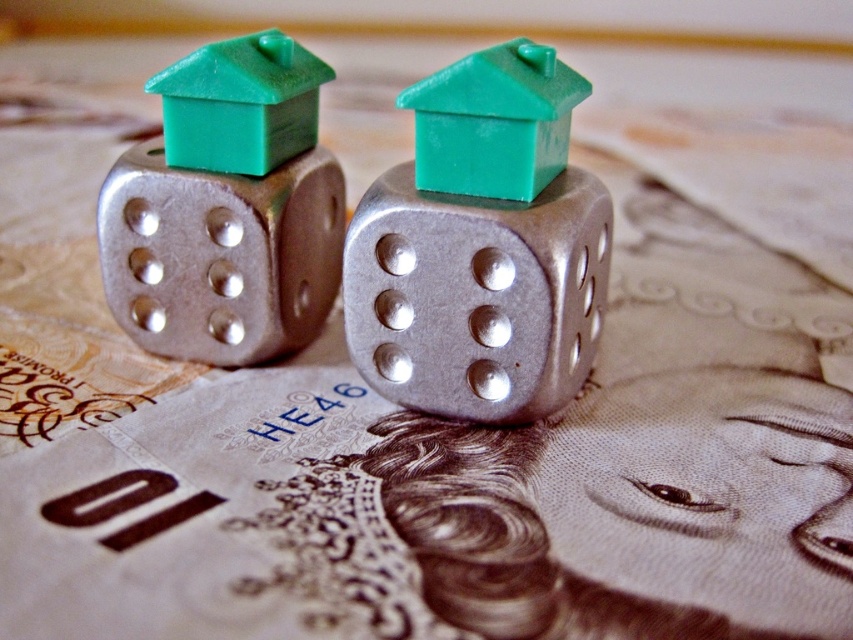
You are examining a banknote with two metallic dice on it. The coordinates point to an object on the banknote. Which object is located at point (219, 256)?

The point (219, 256) corresponds to the metallic silver dice at left.

You are standing in front of a banknote with two metallic dice on it. The dice have green houses on top. Where is the point located at coordinates point (476, 296)?

The point at coordinates point (476, 296) indicates the location of the brushed metal dice at center.

You are a currency inspector examining a counterfeit banknote. You notice two objects on top of the banknote in the image. Which object is larger in size between the brushed metal dice at center and the green matte house at upper center?

The brushed metal dice at center is bigger than the green matte house at upper center according to the description provided.